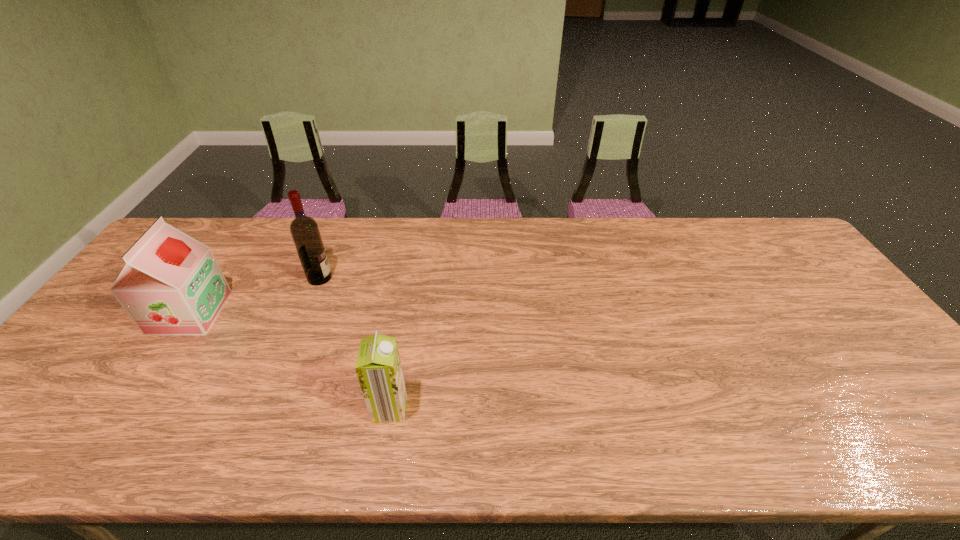
At what (x,y) coordinates should I click in order to perform the action: click on blank area in the image that satisfies the following two spatial constraints: 1. on the front and back of the shortest object; 2. on the right side of the alcohol. Please return your answer as a coordinate pair (x, y). Looking at the image, I should click on (267, 408).

Locate an element on the screen. This screenshot has width=960, height=540. free point that satisfies the following two spatial constraints: 1. with the cap open on the nearest object; 2. on the right side of the second nearest object is located at coordinates click(x=126, y=408).

What are the coordinates of `blank space that satisfies the following two spatial constraints: 1. on the front and back of the farthest object; 2. on the right side of the nearer soya milk` in the screenshot? It's located at pyautogui.click(x=267, y=408).